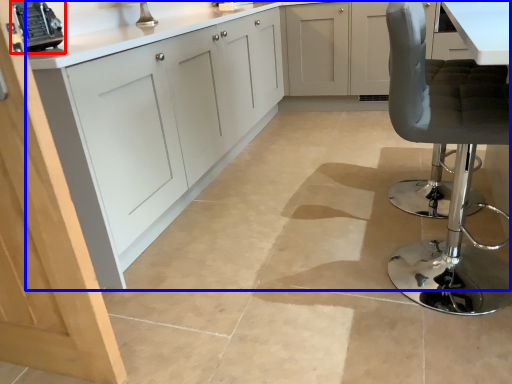
Question: Which object is closer to the camera taking this photo, appliance (highlighted by a red box) or cabinetry (highlighted by a blue box)?

Choices:
 (A) appliance
 (B) cabinetry

Answer: (B)